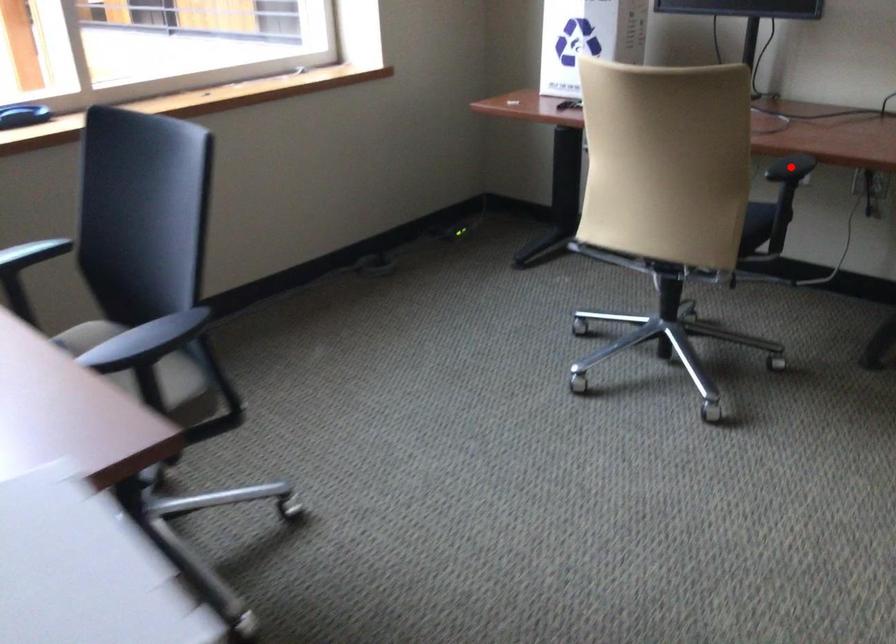
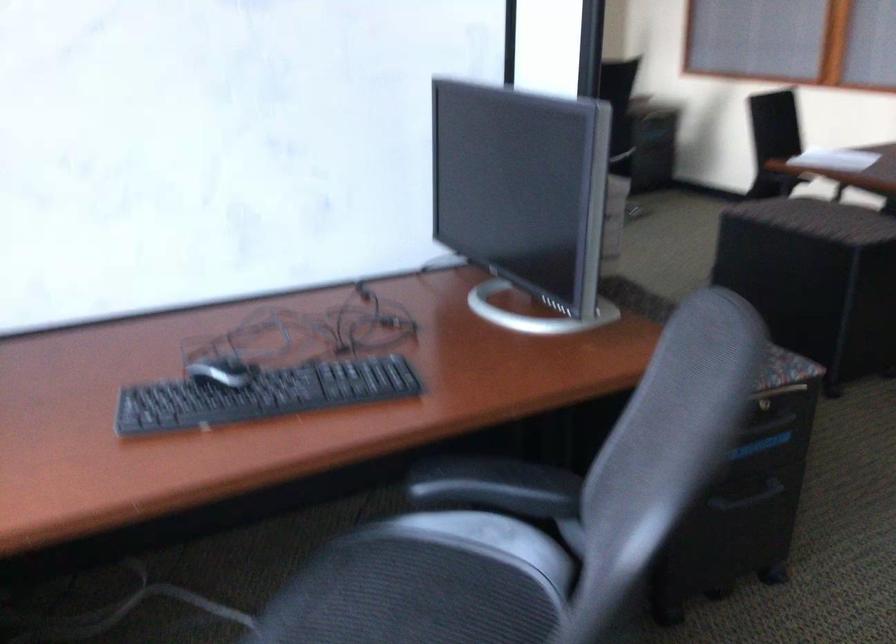
Question: I am providing you with two images of the same scene from different viewpoints. A red point is marked on the first image. At the location where the point appears in image 1, is it still visible in image 2?

Choices:
 (A) Yes
 (B) No

Answer: (B)